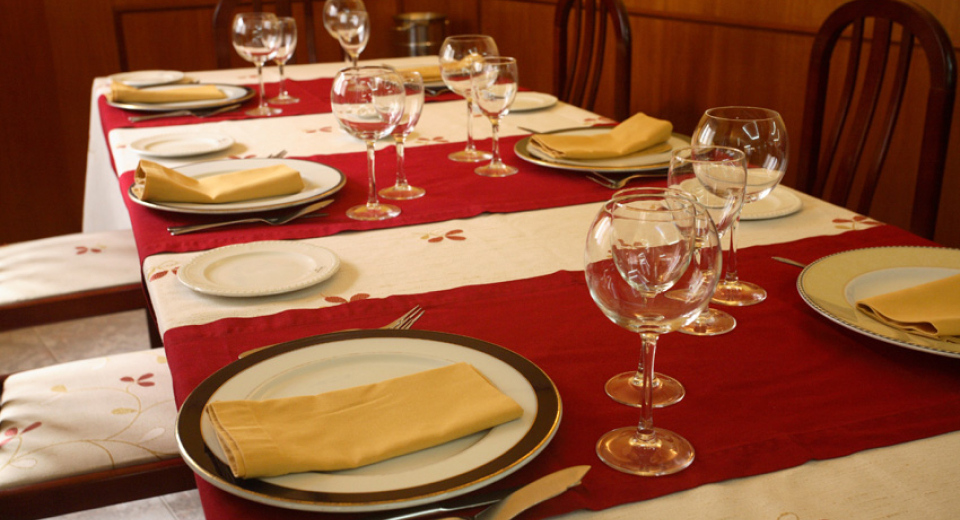
Image resolution: width=960 pixels, height=520 pixels. I want to click on plates, so click(386, 348), click(238, 207), click(181, 102), click(443, 91), click(640, 160), click(840, 282).